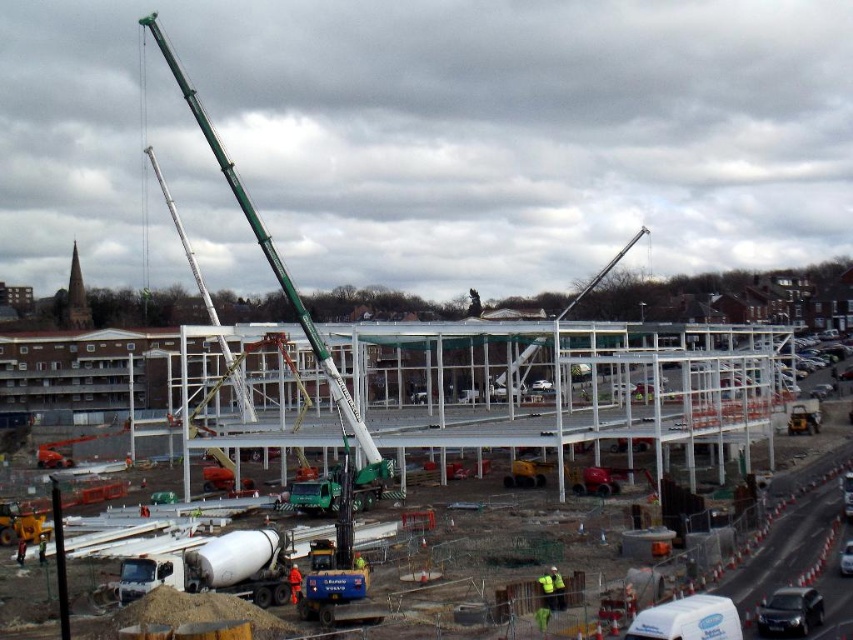
Based on the photo, you are a construction supervisor planning to place a new equipment that requires a space wider than the metallic silver crane at center. Based on the scene, is there a suitable location near the white metallic framework at center to accommodate this new equipment?

The white metallic framework at center is wider than the metallic silver crane at center, so yes, there is a suitable location near the white metallic framework at center to accommodate the new equipment requiring wider space than the metallic silver crane at center.

You are a construction worker standing at point [277,272]. What object is located exactly at your current position?

The green metallic crane at center is located exactly at point [277,272].